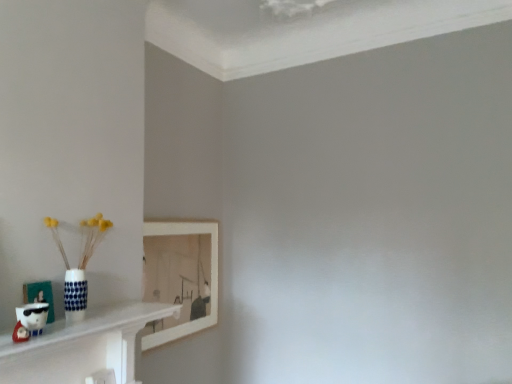
Question: Is matte white picture frame at lower left, positioned as the 1th picture frame in front-to-back order, to the left of white glossy shelf at lower left from the viewer's perspective?

Choices:
 (A) yes
 (B) no

Answer: (A)

Question: Can you confirm if matte white picture frame at lower left, positioned as the 1th picture frame in front-to-back order, is smaller than white glossy shelf at lower left?

Choices:
 (A) no
 (B) yes

Answer: (B)

Question: Is matte white picture frame at lower left, which is the second picture frame from right to left, not within white glossy shelf at lower left?

Choices:
 (A) no
 (B) yes

Answer: (B)

Question: Could you tell me if matte white picture frame at lower left, the second picture frame positioned from the back, is facing white glossy shelf at lower left?

Choices:
 (A) no
 (B) yes

Answer: (A)

Question: From the image's perspective, would you say matte white picture frame at lower left, positioned as the 1th picture frame in front-to-back order, is shown under white glossy shelf at lower left?

Choices:
 (A) no
 (B) yes

Answer: (A)

Question: Is matte white picture frame at lower left, which is the second picture frame from right to left, wider than white glossy shelf at lower left?

Choices:
 (A) no
 (B) yes

Answer: (A)

Question: Can you confirm if matte white picture frame at lower left, which is the second picture frame from right to left, is thinner than white wooden picture frame at upper left, which is the 2th picture frame in front-to-back order?

Choices:
 (A) yes
 (B) no

Answer: (A)

Question: From a real-world perspective, is matte white picture frame at lower left, which is the second picture frame from right to left, on top of white wooden picture frame at upper left, which is the 2th picture frame in front-to-back order?

Choices:
 (A) yes
 (B) no

Answer: (A)

Question: From the image's perspective, is matte white picture frame at lower left, which is the second picture frame from right to left, on top of white wooden picture frame at upper left, which is the 2th picture frame in front-to-back order?

Choices:
 (A) no
 (B) yes

Answer: (B)

Question: Considering the relative positions of matte white picture frame at lower left, positioned as the 1th picture frame in front-to-back order, and white wooden picture frame at upper left, which is the 2th picture frame from left to right, in the image provided, is matte white picture frame at lower left, positioned as the 1th picture frame in front-to-back order, to the right of white wooden picture frame at upper left, which is the 2th picture frame from left to right, from the viewer's perspective?

Choices:
 (A) yes
 (B) no

Answer: (B)

Question: From a real-world perspective, is matte white picture frame at lower left, positioned as the 1th picture frame in front-to-back order, under white wooden picture frame at upper left, which is the 2th picture frame from left to right?

Choices:
 (A) no
 (B) yes

Answer: (A)

Question: Considering the relative positions of matte white picture frame at lower left, which is the second picture frame from right to left, and white wooden picture frame at upper left, which appears as the 1th picture frame when viewed from the right, in the image provided, is matte white picture frame at lower left, which is the second picture frame from right to left, behind white wooden picture frame at upper left, which appears as the 1th picture frame when viewed from the right,?

Choices:
 (A) no
 (B) yes

Answer: (A)

Question: Can you confirm if white wooden picture frame at upper left, which appears as the 1th picture frame when viewed from the right, is wider than matte white picture frame at lower left, which appears as the 1th picture frame when viewed from the left?

Choices:
 (A) yes
 (B) no

Answer: (A)